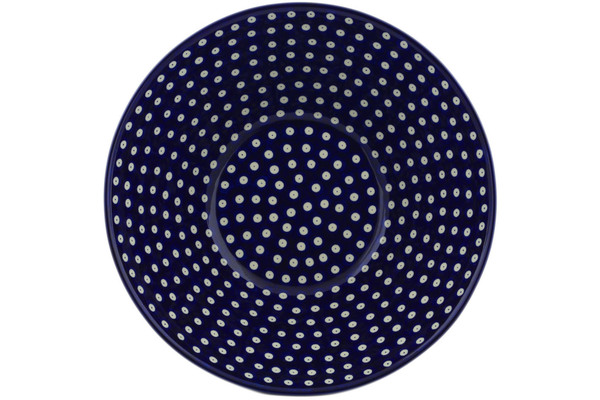
Locate an element on the screen. The width and height of the screenshot is (600, 400). spotted pattern on plate is located at coordinates (294, 195), (305, 204), (291, 215), (279, 187), (272, 203).